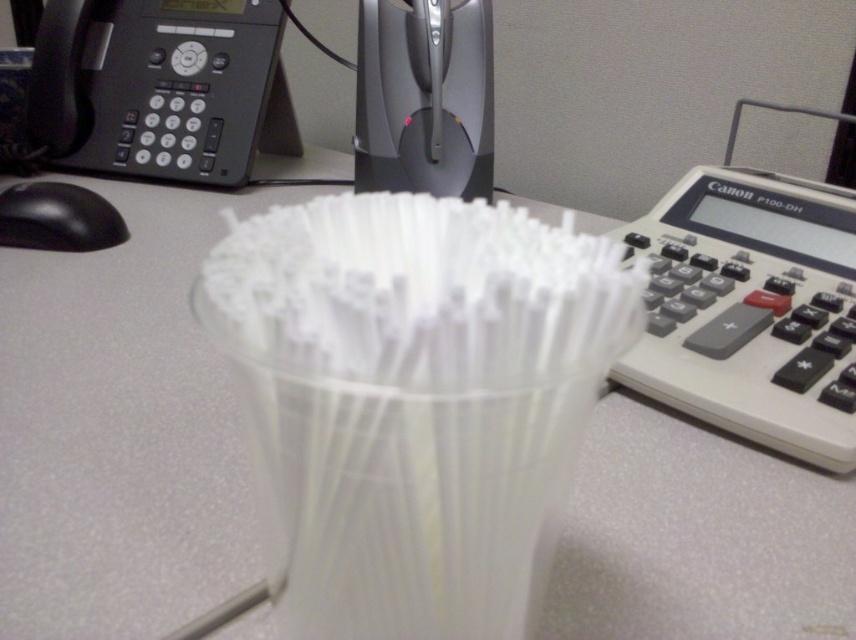
Question: Which point is farther to the camera?

Choices:
 (A) (741, 256)
 (B) (153, 36)
 (C) (336, 316)

Answer: (B)

Question: Which object appears closest to the camera in this image?

Choices:
 (A) white plastic calculator at right
 (B) black plastic phone at upper left
 (C) transparent plastic straws at center

Answer: (C)

Question: Is transparent plastic straws at center in front of black plastic phone at upper left?

Choices:
 (A) yes
 (B) no

Answer: (A)

Question: Does transparent plastic straws at center come behind black plastic phone at upper left?

Choices:
 (A) no
 (B) yes

Answer: (A)

Question: Can you confirm if transparent plastic straws at center is positioned above black plastic phone at upper left?

Choices:
 (A) no
 (B) yes

Answer: (A)

Question: Estimate the real-world distances between objects in this image. Which object is closer to the white plastic calculator at right?

Choices:
 (A) black plastic phone at upper left
 (B) transparent plastic straws at center

Answer: (B)